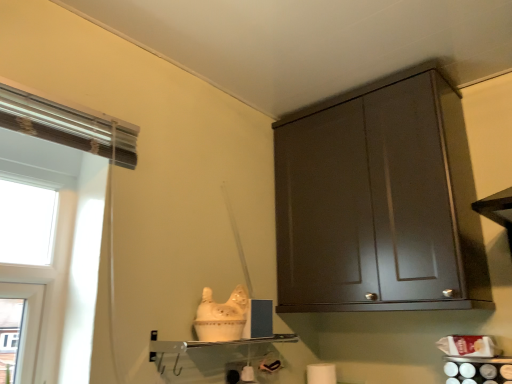
You are a GUI agent. You are given a task and a screenshot of the screen. Output one action in this format:
    pyautogui.click(x=<x>, y=<y>)
    Task: Click on the clear glass shelf at center
    
    Given the screenshot: What is the action you would take?
    pyautogui.click(x=215, y=343)

This screenshot has height=384, width=512. Describe the element at coordinates (378, 201) in the screenshot. I see `dark wood cabinet at upper right` at that location.

Where is `dark wood cabinet at upper right`? dark wood cabinet at upper right is located at coordinates (378, 201).

Where is `clear glass shelf at center`? Image resolution: width=512 pixels, height=384 pixels. clear glass shelf at center is located at coordinates (215, 343).

Does point (340, 154) come behind point (158, 347)?

Yes, it is behind point (158, 347).

From a real-world perspective, is dark wood cabinet at upper right over clear glass shelf at center?

Correct, in the physical world, dark wood cabinet at upper right is higher than clear glass shelf at center.

In terms of size, does dark wood cabinet at upper right appear bigger or smaller than clear glass shelf at center?

Clearly, dark wood cabinet at upper right is larger in size than clear glass shelf at center.

Where is `cabinetry on the right of clear glass shelf at center`? The height and width of the screenshot is (384, 512). cabinetry on the right of clear glass shelf at center is located at coordinates (378, 201).

Between point (311, 369) and point (284, 338), which one is positioned behind?

The point (311, 369) is behind.

Which is more to the right, white matte toilet paper at lower center or clear glass shelf at center?

white matte toilet paper at lower center.

Which of these two, white matte toilet paper at lower center or clear glass shelf at center, stands taller?

white matte toilet paper at lower center is taller.

Does white matte toilet paper at lower center have a greater width compared to dark wood cabinet at upper right?

Incorrect, the width of white matte toilet paper at lower center does not surpass that of dark wood cabinet at upper right.

Where is `toilet paper to the left of dark wood cabinet at upper right`? toilet paper to the left of dark wood cabinet at upper right is located at coordinates (321, 373).

Is white matte toilet paper at lower center facing away from dark wood cabinet at upper right?

That's not correct — white matte toilet paper at lower center is not looking away from dark wood cabinet at upper right.

Who is smaller, dark wood cabinet at upper right or white matte toilet paper at lower center?

white matte toilet paper at lower center is smaller.

Considering the relative positions of dark wood cabinet at upper right and white matte toilet paper at lower center in the image provided, is dark wood cabinet at upper right to the right of white matte toilet paper at lower center from the viewer's perspective?

Yes.

At what (x,y) coordinates should I click in order to perform the action: click on cabinetry lying above the white matte toilet paper at lower center (from the image's perspective). Please return your answer as a coordinate pair (x, y). Looking at the image, I should click on (378, 201).

In the scene shown: From a real-world perspective, relative to white matte toilet paper at lower center, is dark wood cabinet at upper right vertically above or below?

dark wood cabinet at upper right is situated higher than white matte toilet paper at lower center in the real world.

Where is `cabinetry on the right of the clear glass shelf at center`? This screenshot has height=384, width=512. cabinetry on the right of the clear glass shelf at center is located at coordinates (378, 201).

Is clear glass shelf at center taller or shorter than dark wood cabinet at upper right?

clear glass shelf at center is shorter than dark wood cabinet at upper right.

Which object is positioned more to the left, clear glass shelf at center or dark wood cabinet at upper right?

Positioned to the left is clear glass shelf at center.

From a real-world perspective, is clear glass shelf at center located beneath white matte toilet paper at lower center?

No, from a real-world perspective, clear glass shelf at center is not under white matte toilet paper at lower center.

Is clear glass shelf at center turned away from white matte toilet paper at lower center?

No, white matte toilet paper at lower center is not at the back of clear glass shelf at center.

Which is more to the right, clear glass shelf at center or white matte toilet paper at lower center?

white matte toilet paper at lower center is more to the right.

Who is shorter, clear glass shelf at center or white matte toilet paper at lower center?

With less height is clear glass shelf at center.

Image resolution: width=512 pixels, height=384 pixels. Identify the location of cabinetry lying behind the clear glass shelf at center. (378, 201).

You are a GUI agent. You are given a task and a screenshot of the screen. Output one action in this format:
    pyautogui.click(x=<x>, y=<y>)
    Task: Click on the shelf on the left of white matte toilet paper at lower center
    This screenshot has height=384, width=512.
    Given the screenshot: What is the action you would take?
    pyautogui.click(x=215, y=343)

Based on their spatial positions, is white matte toilet paper at lower center or clear glass shelf at center further from dark wood cabinet at upper right?

white matte toilet paper at lower center is positioned further to the anchor dark wood cabinet at upper right.

Based on their spatial positions, is clear glass shelf at center or dark wood cabinet at upper right closer to white matte toilet paper at lower center?

Based on the image, clear glass shelf at center appears to be nearer to white matte toilet paper at lower center.

From the image, which object appears to be nearer to clear glass shelf at center, white matte toilet paper at lower center or dark wood cabinet at upper right?

Among the two, white matte toilet paper at lower center is located nearer to clear glass shelf at center.

Based on their spatial positions, is clear glass shelf at center or white matte toilet paper at lower center further from dark wood cabinet at upper right?

white matte toilet paper at lower center is further to dark wood cabinet at upper right.

When comparing their distances from clear glass shelf at center, does dark wood cabinet at upper right or white matte toilet paper at lower center seem further?

dark wood cabinet at upper right lies further to clear glass shelf at center than the other object.

Based on their spatial positions, is dark wood cabinet at upper right or clear glass shelf at center further from white matte toilet paper at lower center?

dark wood cabinet at upper right lies further to white matte toilet paper at lower center than the other object.

In order to click on shelf between dark wood cabinet at upper right and white matte toilet paper at lower center vertically in this screenshot , I will do `click(215, 343)`.